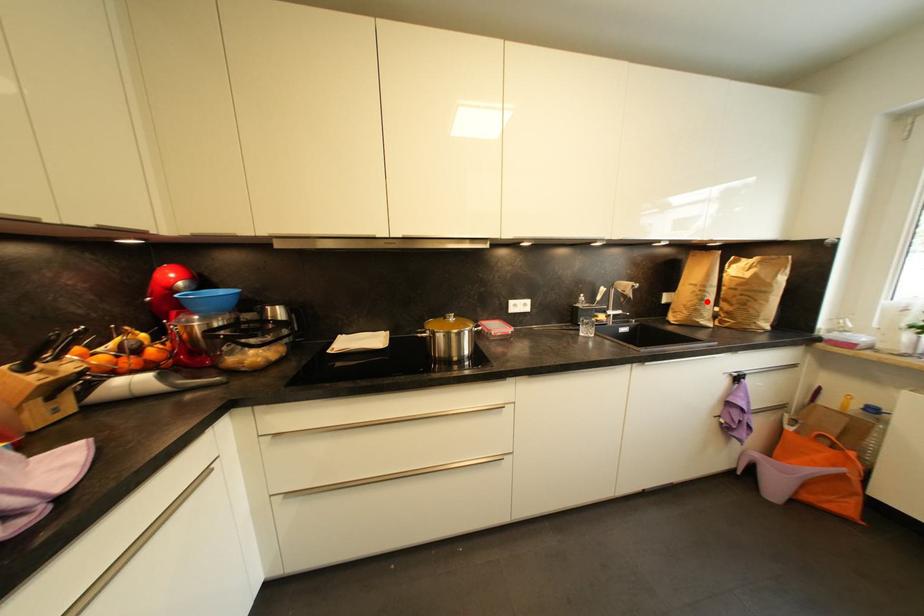
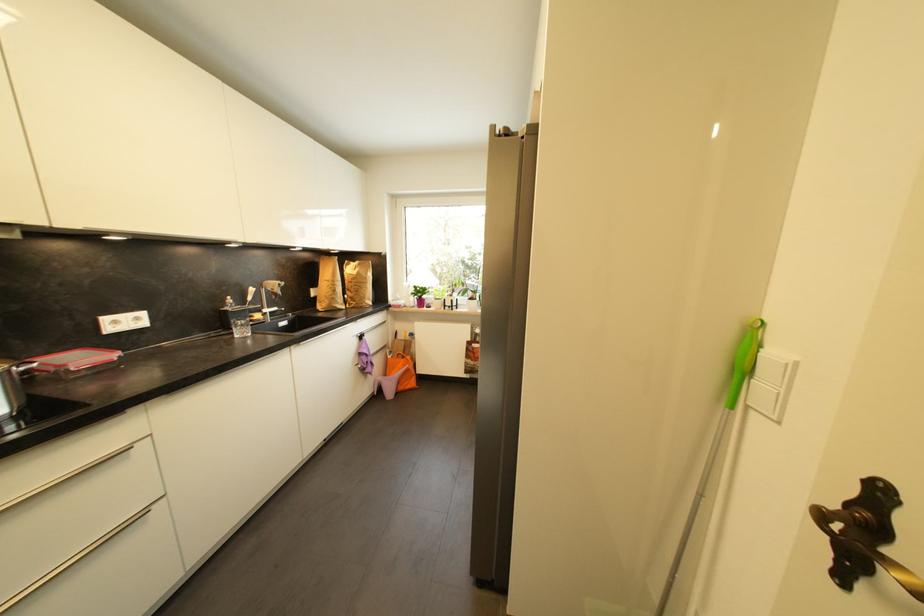
Question: I am providing you with two images of the same scene from different viewpoints. Image1 has a red point marked. In image2, the corresponding 3D location appears at what relative position? Reply with the corresponding letter.

Choices:
 (A) Closer
 (B) Farther

Answer: (A)